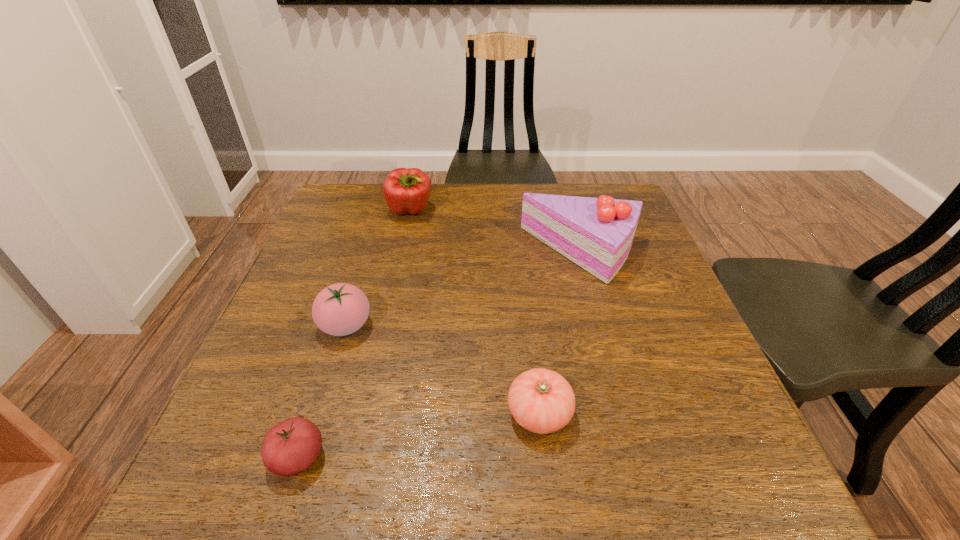
Where is `cake`? The image size is (960, 540). cake is located at coordinates (595, 233).

What are the coordinates of `the farthest object` in the screenshot? It's located at (406, 190).

Where is `the farthest tomato`? The height and width of the screenshot is (540, 960). the farthest tomato is located at coordinates (340, 309).

Where is `the third tallest object`? the third tallest object is located at coordinates (340, 309).

At what (x,y) coordinates should I click in order to perform the action: click on the rightmost tomato. Please return your answer as a coordinate pair (x, y). The image size is (960, 540). Looking at the image, I should click on (542, 401).

The image size is (960, 540). What are the coordinates of `vacant space positioned 0.060m on the back of the fourth nearest object` in the screenshot? It's located at [571, 215].

Locate an element on the screen. The height and width of the screenshot is (540, 960). free space located 0.290m on the front of the bell pepper is located at coordinates (392, 296).

You are a GUI agent. You are given a task and a screenshot of the screen. Output one action in this format:
    pyautogui.click(x=<x>, y=<y>)
    Task: Click on the free space located on the right of the third tallest object
    This screenshot has width=960, height=540.
    Given the screenshot: What is the action you would take?
    pyautogui.click(x=520, y=325)

At what (x,y) coordinates should I click in order to perform the action: click on vacant space located on the back of the rightmost tomato. Please return your answer as a coordinate pair (x, y). This screenshot has height=540, width=960. Looking at the image, I should click on (526, 294).

The height and width of the screenshot is (540, 960). What are the coordinates of `object located in the far edge section of the desktop` in the screenshot? It's located at (406, 190).